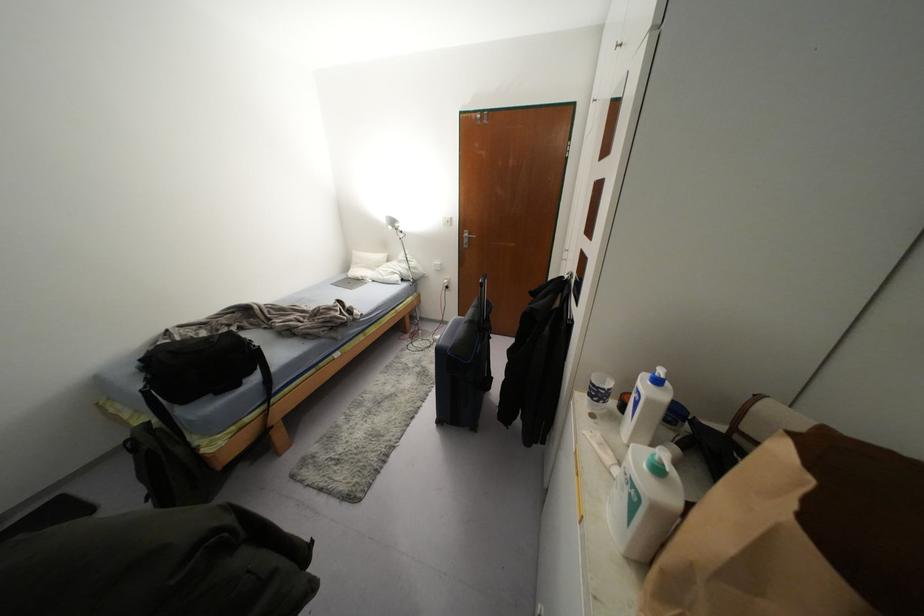
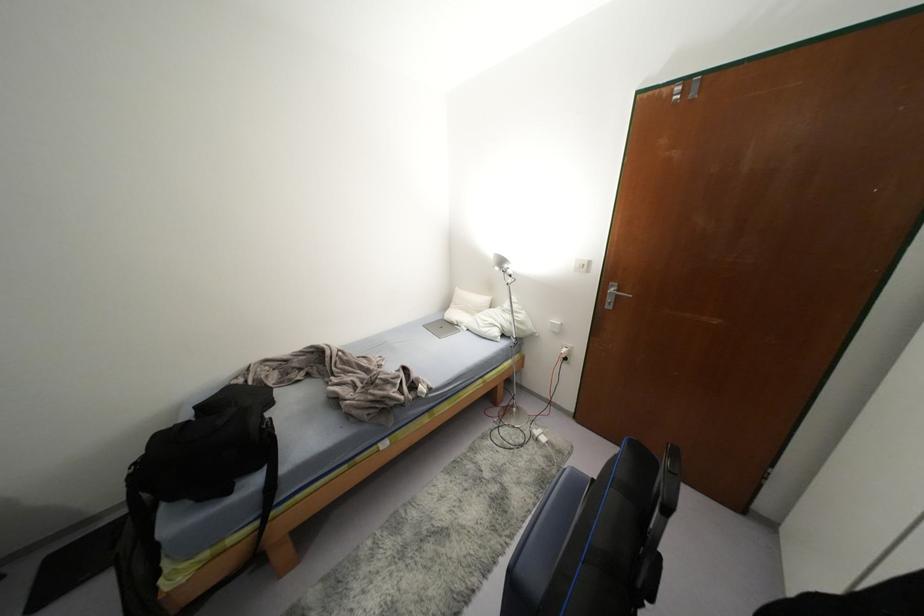
Where in the second image is the point corresponding to pixel 358 281 from the first image?

(452, 325)